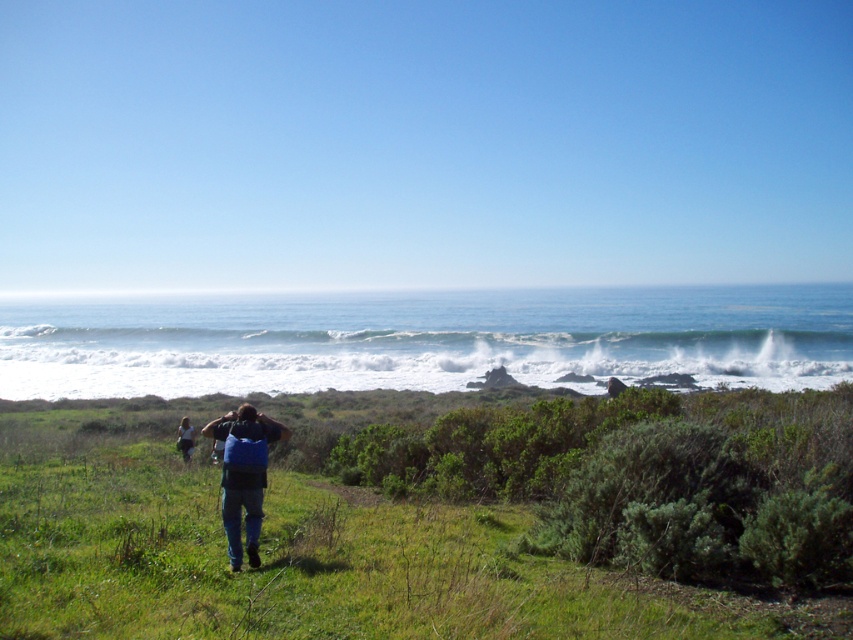
You are standing at the edge of the grassy area and want to place your blue fabric backpack at lower center on the green grassy at center. Will the backpack fit entirely on the grassy area without any part hanging off?

The green grassy at center is bigger than the blue fabric backpack at lower center, so yes, the backpack will fit entirely on the grassy area without any part hanging off.

You are a hiker who wants to take a photo of the ocean while standing on the green grassy at center. Since you need to ensure the blue fabric backpack at center doesn not block the view, can you tell me whether the backpack is shorter or taller than the grass?

The green grassy at center has a greater height compared to the blue fabric backpack at center, so the backpack is shorter than the grass. Therefore, it will not block the view of the ocean.

You are standing at the edge of the grassy area and want to place a small flag on the green grassy at center. To ensure the flag is visible from the blue fabric backpack at lower center, should you place it closer to the backpack or further away?

The green grassy at center is in front of the blue fabric backpack at lower center, so placing the flag closer to the backpack would make it visible from that position.